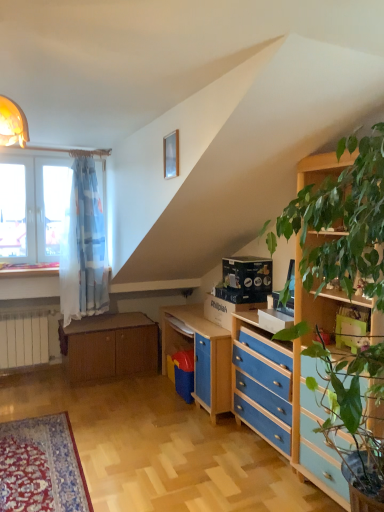
This screenshot has height=512, width=384. What do you see at coordinates (109, 346) in the screenshot? I see `wooden cabinet at lower left` at bounding box center [109, 346].

From the picture: In order to face blue painted wood chest of drawers at lower right, should I rotate leftwards or rightwards?

Turn right approximately 11.569 degrees to face it.

What do you see at coordinates (29, 269) in the screenshot?
I see `wooden at left` at bounding box center [29, 269].

Find the location of a particular element. This screenshot has width=384, height=512. wooden cabinet at lower left is located at coordinates (109, 346).

From the image's perspective, is wooden at left below blue painted wood chest of drawers at lower right?

No, from the image's perspective, wooden at left is not below blue painted wood chest of drawers at lower right.

Which of these two, wooden at left or blue painted wood chest of drawers at lower right, is wider?

blue painted wood chest of drawers at lower right.

Is point (26, 273) positioned after point (332, 467)?

Yes, point (26, 273) is behind point (332, 467).

Is blue painted wood chest of drawers at lower right smaller than wooden cabinet at lower left?

Indeed, blue painted wood chest of drawers at lower right has a smaller size compared to wooden cabinet at lower left.

Is blue painted wood chest of drawers at lower right next to wooden cabinet at lower left and touching it?

No, blue painted wood chest of drawers at lower right is not with wooden cabinet at lower left.

Is blue painted wood chest of drawers at lower right facing away from wooden cabinet at lower left?

No, wooden cabinet at lower left is not at the back of blue painted wood chest of drawers at lower right.

Can wooden cabinet at lower left be found inside blue painted wood chest of drawers at lower right?

No, wooden cabinet at lower left is located outside of blue painted wood chest of drawers at lower right.

In the scene shown: Which point is more distant from viewer, (x=22, y=269) or (x=120, y=373)?

Positioned behind is point (x=120, y=373).

Find the location of a particular element. table below the wooden at left (from a real-world perspective) is located at coordinates (109, 346).

In the scene shown: Is wooden at left bigger than wooden cabinet at lower left?

No, wooden at left is not bigger than wooden cabinet at lower left.

Is wooden at left at the left side of wooden cabinet at lower left?

Indeed, wooden at left is positioned on the left side of wooden cabinet at lower left.

Which is correct: wooden cabinet at lower left is inside wooden at left, or outside of it?

wooden cabinet at lower left cannot be found inside wooden at left.

Is wooden cabinet at lower left bigger than wooden at left?

Yes, wooden cabinet at lower left is bigger than wooden at left.

From the image's perspective, who appears lower, wooden cabinet at lower left or wooden at left?

From the image's view, wooden cabinet at lower left is below.

Can you tell me how much wooden cabinet at lower left and wooden at left differ in facing direction?

The angle between the facing direction of wooden cabinet at lower left and the facing direction of wooden at left is 7.91e-05 degrees.

Is blue painted wood chest of drawers at lower right facing towards wooden at left?

No, blue painted wood chest of drawers at lower right does not turn towards wooden at left.

Which of these two, blue painted wood chest of drawers at lower right or wooden at left, stands taller?

With more height is blue painted wood chest of drawers at lower right.

The height and width of the screenshot is (512, 384). Identify the location of chest of drawers that appears on the right of wooden at left. (341, 464).

Does point (98, 328) come behind point (243, 368)?

Yes.

Is wooden cabinet at lower left taller or shorter than blue painted wood chest of drawers at lower right?

Clearly, wooden cabinet at lower left is shorter compared to blue painted wood chest of drawers at lower right.

Does wooden cabinet at lower left turn towards blue painted wood chest of drawers at lower right?

Yes.

How different are the orientations of wooden cabinet at lower left and blue painted wood chest of drawers at lower right in degrees?

90 degrees separate the facing orientations of wooden cabinet at lower left and blue painted wood chest of drawers at lower right.

Where is `the chest of drawers that is under the wooden at left (from a real-world perspective)`? Image resolution: width=384 pixels, height=512 pixels. the chest of drawers that is under the wooden at left (from a real-world perspective) is located at coordinates (341, 464).

The width and height of the screenshot is (384, 512). There is a wooden cabinet at lower left. Identify the location of the chest of drawers above it (from a real-world perspective). (341, 464).

Considering their positions, is blue painted wood chest of drawers at lower right positioned further to wooden at left than wooden cabinet at lower left?

Among the two, blue painted wood chest of drawers at lower right is located further to wooden at left.

From the image, which object appears to be farther from wooden cabinet at lower left, blue painted wood chest of drawers at lower right or wooden at left?

blue painted wood chest of drawers at lower right is further to wooden cabinet at lower left.

Based on the photo, when comparing their distances from blue painted wood chest of drawers at lower right, does wooden at left or wooden cabinet at lower left seem closer?

wooden cabinet at lower left.

Which object lies nearer to the anchor point wooden cabinet at lower left, wooden at left or blue painted wood chest of drawers at lower right?

Among the two, wooden at left is located nearer to wooden cabinet at lower left.

Looking at the image, which one is located closer to wooden at left, wooden cabinet at lower left or blue painted wood chest of drawers at lower right?

wooden cabinet at lower left is closer to wooden at left.

Looking at the image, which one is located further to blue painted wood chest of drawers at lower right, wooden cabinet at lower left or wooden at left?

wooden at left lies further to blue painted wood chest of drawers at lower right than the other object.

The height and width of the screenshot is (512, 384). I want to click on table between wooden at left and blue painted wood chest of drawers at lower right, so click(x=109, y=346).